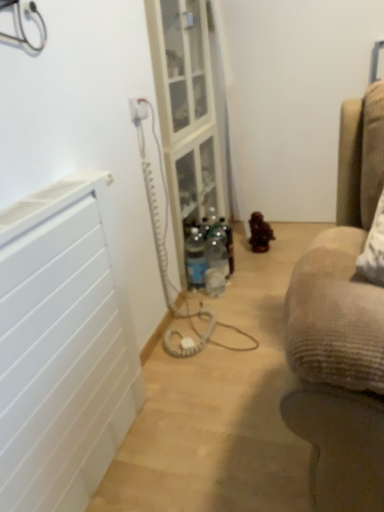
Question: Is white matte radiator at left facing away from clear glass shelf at center?

Choices:
 (A) no
 (B) yes

Answer: (A)

Question: Is white matte radiator at left bigger than clear glass shelf at center?

Choices:
 (A) no
 (B) yes

Answer: (A)

Question: From the image's perspective, is white matte radiator at left above clear glass shelf at center?

Choices:
 (A) yes
 (B) no

Answer: (B)

Question: Is white matte radiator at left closer to camera compared to clear glass shelf at center?

Choices:
 (A) no
 (B) yes

Answer: (B)

Question: Is clear glass shelf at center located within white matte radiator at left?

Choices:
 (A) no
 (B) yes

Answer: (A)

Question: Considering the positions of point click(134, 99) and point click(180, 231), is point click(134, 99) closer or farther from the camera than point click(180, 231)?

Choices:
 (A) closer
 (B) farther

Answer: (A)

Question: From a real-world perspective, relative to clear glass shelf at center, is white plastic electric outlet at upper center vertically above or below?

Choices:
 (A) above
 (B) below

Answer: (A)

Question: In terms of width, does white plastic electric outlet at upper center look wider or thinner when compared to clear glass shelf at center?

Choices:
 (A) wide
 (B) thin

Answer: (B)

Question: Would you say white plastic electric outlet at upper center is inside or outside clear glass shelf at center?

Choices:
 (A) outside
 (B) inside

Answer: (A)

Question: Is white matte radiator at left bigger or smaller than clear glass shelf at center?

Choices:
 (A) small
 (B) big

Answer: (A)

Question: In the image, is white matte radiator at left positioned in front of or behind clear glass shelf at center?

Choices:
 (A) front
 (B) behind

Answer: (A)

Question: From the image's perspective, is white matte radiator at left located above or below clear glass shelf at center?

Choices:
 (A) above
 (B) below

Answer: (B)

Question: Is point (91, 329) positioned closer to the camera than point (203, 208)?

Choices:
 (A) farther
 (B) closer

Answer: (B)

Question: Would you say clear glass shelf at center is to the left or to the right of clear plastic bottle at center in the picture?

Choices:
 (A) right
 (B) left

Answer: (B)

Question: From the image's perspective, relative to clear plastic bottle at center, is clear glass shelf at center above or below?

Choices:
 (A) below
 (B) above

Answer: (B)